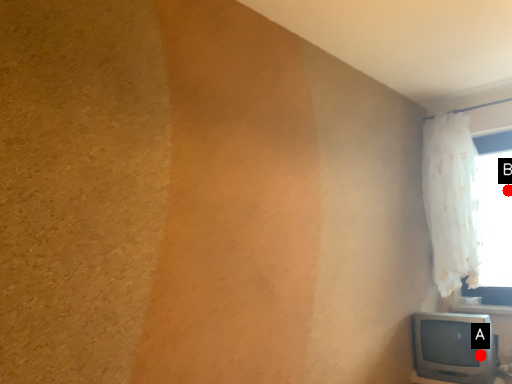
Question: Two points are circled on the image, labeled by A and B beside each circle. Which point is closer to the camera?

Choices:
 (A) A is closer
 (B) B is closer

Answer: (A)